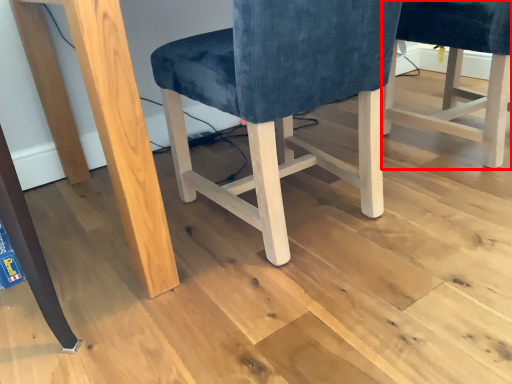
Question: From the image's perspective, where is chair (annotated by the red box) located relative to chair?

Choices:
 (A) below
 (B) above

Answer: (B)